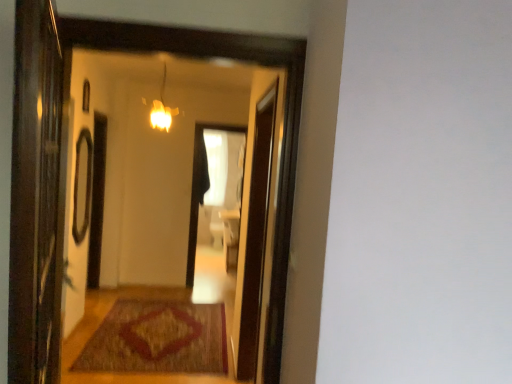
This screenshot has width=512, height=384. In order to click on vacant space in matte glass light fixture at upper center (from a real-world perspective) in this screenshot , I will do pyautogui.click(x=144, y=349).